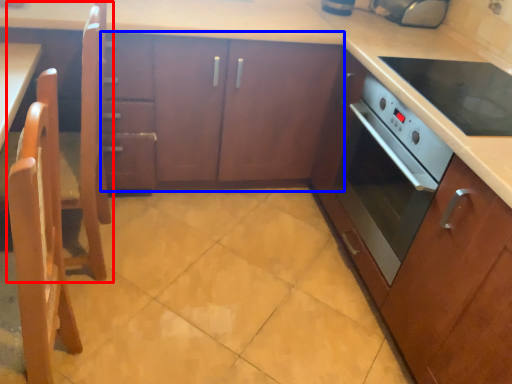
Question: Which point is further to the camera, chair (highlighted by a red box) or cabinetry (highlighted by a blue box)?

Choices:
 (A) chair
 (B) cabinetry

Answer: (B)